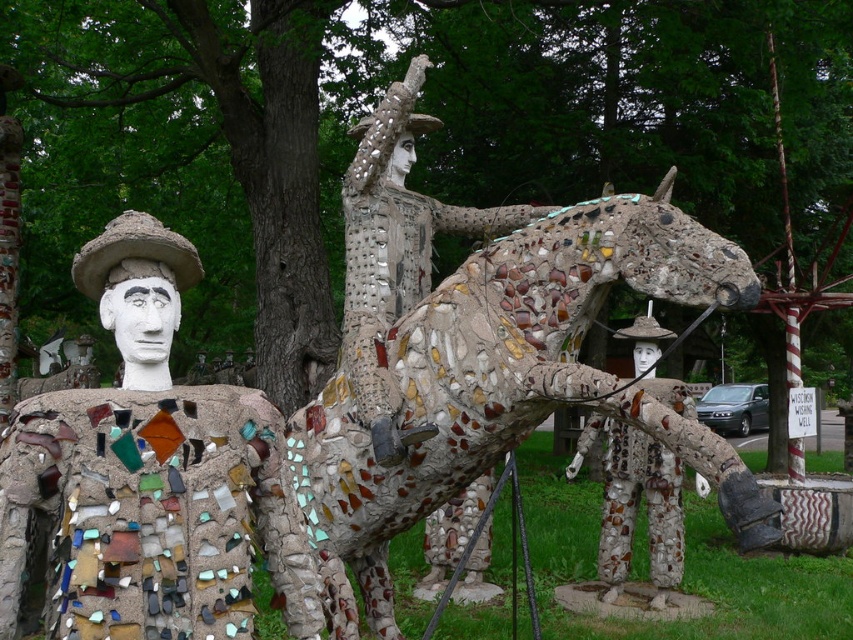
You are a tour guide explaining the outdoor sculptures to visitors. You mention both the mosaic horse at center and the mosaic man at left. Which one should you point out first if you want to show the taller sculpture?

The mosaic horse at center is much taller than the mosaic man at left, so you should point out the mosaic horse at center first.

You are an artist planning to create a new sculpture that needs to fit between the mosaic horse at center and the mosaic man at left. Which sculpture should you base your design on to ensure it fits within the space between them?

The mosaic horse at center is wider than the mosaic man at left. Therefore, you should base your design on the mosaic man at left to ensure it fits within the space between them.